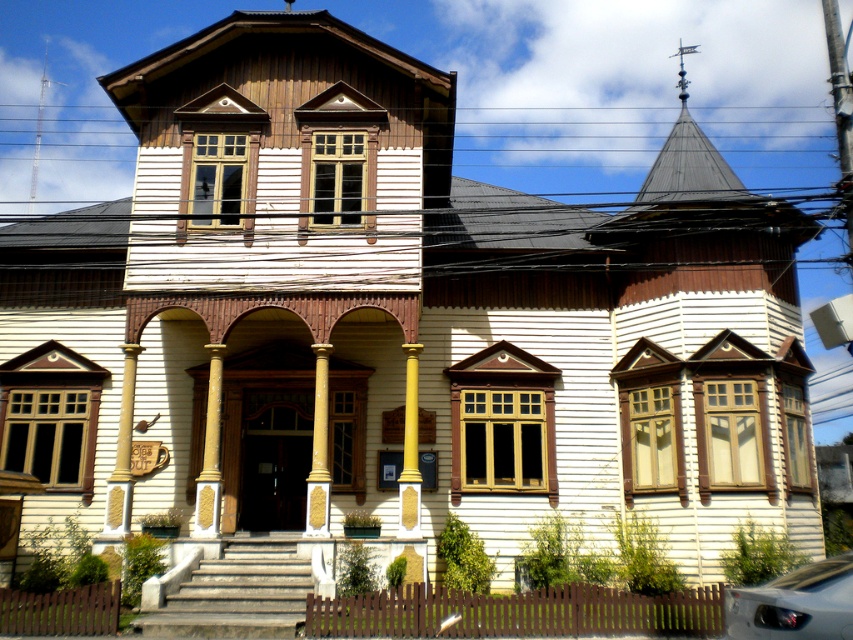
Question: Does yellow polished wood column at center lie behind gold polished column at center?

Choices:
 (A) yes
 (B) no

Answer: (A)

Question: Which of these objects is positioned closest to the yellow polished column at center?

Choices:
 (A) yellow polished wood column at center
 (B) gold polished column at center
 (C) smooth cream-colored column at center

Answer: (B)

Question: From the image, what is the correct spatial relationship of stone steps at center in relation to yellow polished wood column at center?

Choices:
 (A) left
 (B) right

Answer: (B)

Question: From the image, what is the correct spatial relationship of yellow polished column at center in relation to polished silver spire at upper center?

Choices:
 (A) left
 (B) right

Answer: (A)

Question: Which of the following is the closest to the observer?

Choices:
 (A) (297, 592)
 (B) (310, 484)
 (C) (115, 483)

Answer: (A)

Question: Which of the following is the closest to the observer?

Choices:
 (A) (412, 372)
 (B) (287, 576)

Answer: (B)